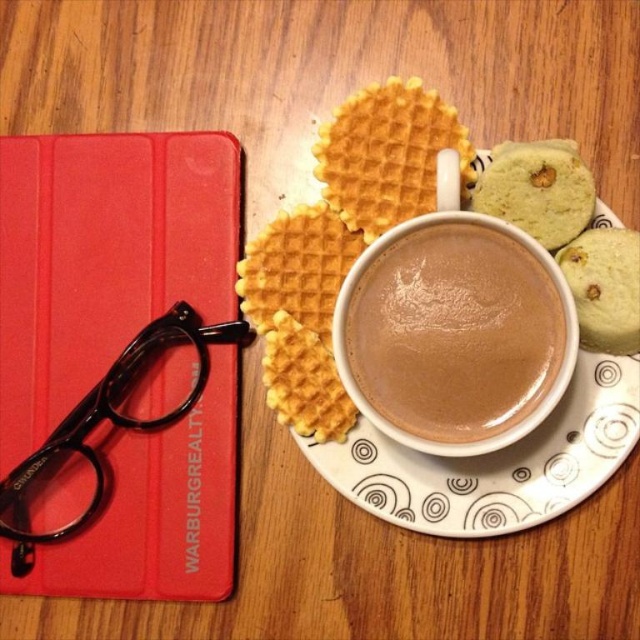
You are a delivery person who needs to place a 12 inch long package between the red matte tablet at left and the golden textured waffle at upper center on the table. Can the package fit in the space between them without overlapping either object?

The distance between the red matte tablet at left and the golden textured waffle at upper center is 12.27 inches. Since the package is 12 inches long, it can fit in the space between them without overlapping either object as there is enough space.